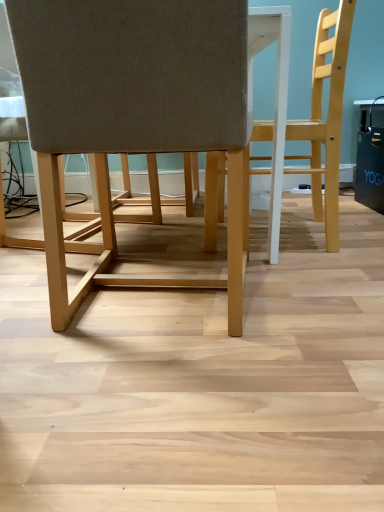
Question: Which direction should I rotate to face light brown fabric chair at center, placed as the 2th chair when sorted from right to left, — up or down?

Choices:
 (A) up
 (B) down

Answer: (A)

Question: Is light wood chair at right, which is the second chair from left to right, surrounded by light brown fabric chair at center, placed as the 2th chair when sorted from right to left?

Choices:
 (A) yes
 (B) no

Answer: (B)

Question: From a real-world perspective, is light brown fabric chair at center, placed as the 2th chair when sorted from right to left, below light wood chair at right, the 1th chair positioned from the right?

Choices:
 (A) yes
 (B) no

Answer: (A)

Question: From a real-world perspective, is light brown fabric chair at center, which is the 1th chair in left-to-right order, physically above light wood chair at right, the 1th chair positioned from the right?

Choices:
 (A) no
 (B) yes

Answer: (A)

Question: Is light brown fabric chair at center, which is the 1th chair in left-to-right order, positioned before light wood chair at right, the 1th chair positioned from the right?

Choices:
 (A) no
 (B) yes

Answer: (B)

Question: Is light brown fabric chair at center, which is the 1th chair in left-to-right order, taller than light wood chair at right, which is the second chair from left to right?

Choices:
 (A) no
 (B) yes

Answer: (A)

Question: Does light brown fabric chair at center, which is the 1th chair in left-to-right order, lie behind light wood chair at right, which is the second chair from left to right?

Choices:
 (A) yes
 (B) no

Answer: (B)

Question: Considering the relative sizes of light wood chair at right, the 1th chair positioned from the right, and light brown fabric chair at center, which is the 1th chair in left-to-right order, in the image provided, is light wood chair at right, the 1th chair positioned from the right, wider than light brown fabric chair at center, which is the 1th chair in left-to-right order,?

Choices:
 (A) yes
 (B) no

Answer: (B)

Question: From the image's perspective, is light wood chair at right, which is the second chair from left to right, under light brown fabric chair at center, which is the 1th chair in left-to-right order?

Choices:
 (A) yes
 (B) no

Answer: (B)

Question: From a real-world perspective, is light wood chair at right, which is the second chair from left to right, located higher than light brown fabric chair at center, which is the 1th chair in left-to-right order?

Choices:
 (A) no
 (B) yes

Answer: (B)

Question: Considering the relative sizes of light wood chair at right, the 1th chair positioned from the right, and light brown fabric chair at center, which is the 1th chair in left-to-right order, in the image provided, is light wood chair at right, the 1th chair positioned from the right, bigger than light brown fabric chair at center, which is the 1th chair in left-to-right order,?

Choices:
 (A) yes
 (B) no

Answer: (B)

Question: Is light wood chair at right, the 1th chair positioned from the right, thinner than light brown fabric chair at center, which is the 1th chair in left-to-right order?

Choices:
 (A) no
 (B) yes

Answer: (B)

Question: From the image's perspective, is light wood chair at right, the 1th chair positioned from the right, located above light brown fabric chair at center, which is the 1th chair in left-to-right order?

Choices:
 (A) yes
 (B) no

Answer: (A)

Question: Visually, is light wood chair at right, which is the second chair from left to right, positioned to the left or to the right of light brown fabric chair at center, which is the 1th chair in left-to-right order?

Choices:
 (A) right
 (B) left

Answer: (A)